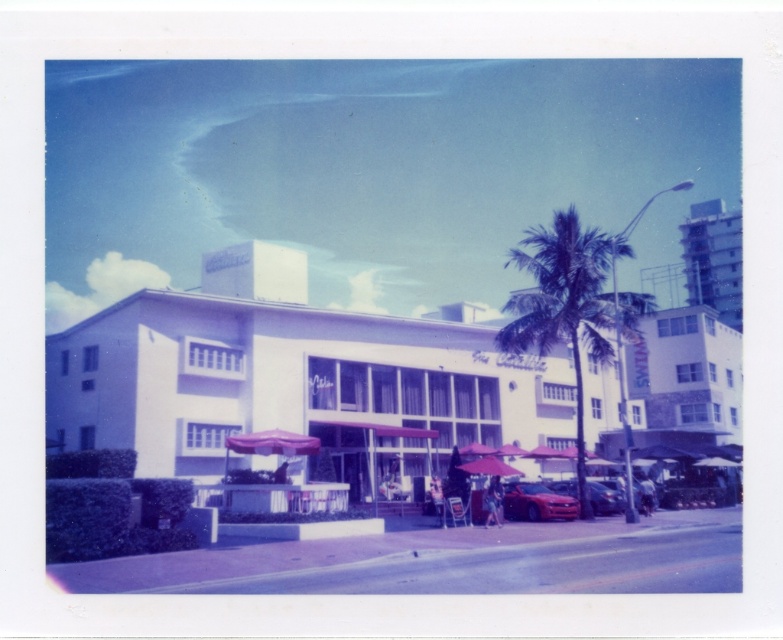
Question: Which point appears farthest from the camera in this image?

Choices:
 (A) (708, 292)
 (B) (540, 513)
 (C) (576, 342)
 (D) (558, 490)

Answer: (A)

Question: Can you confirm if green leafy palm tree at center-right is bigger than shiny red sedan at lower right?

Choices:
 (A) no
 (B) yes

Answer: (B)

Question: Among these objects, which one is farthest from the camera?

Choices:
 (A) shiny red car at lower right
 (B) pink fabric umbrella at center
 (C) shiny red sedan at lower right

Answer: (A)

Question: Is smooth concrete building at upper right positioned at the back of shiny red car at lower right?

Choices:
 (A) no
 (B) yes

Answer: (B)

Question: Which of the following is the closest to the observer?

Choices:
 (A) green leafy palm tree at center-right
 (B) smooth concrete building at upper right
 (C) pink fabric umbrella at center
 (D) white matte building at center

Answer: (C)

Question: Considering the relative positions of pink fabric umbrella at center and shiny red car at lower right in the image provided, where is pink fabric umbrella at center located with respect to shiny red car at lower right?

Choices:
 (A) left
 (B) right

Answer: (A)